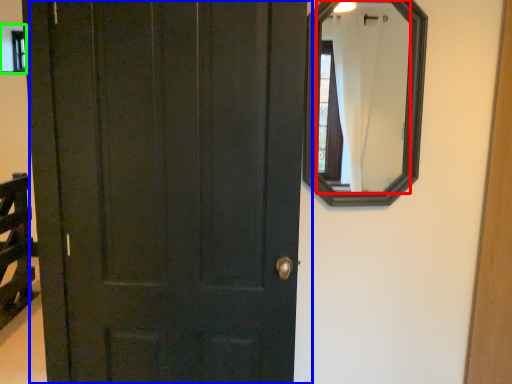
Question: Estimate the real-world distances between objects in this image. Which object is closer to mirror (highlighted by a red box), door (highlighted by a blue box) or window (highlighted by a green box)?

Choices:
 (A) door
 (B) window

Answer: (B)